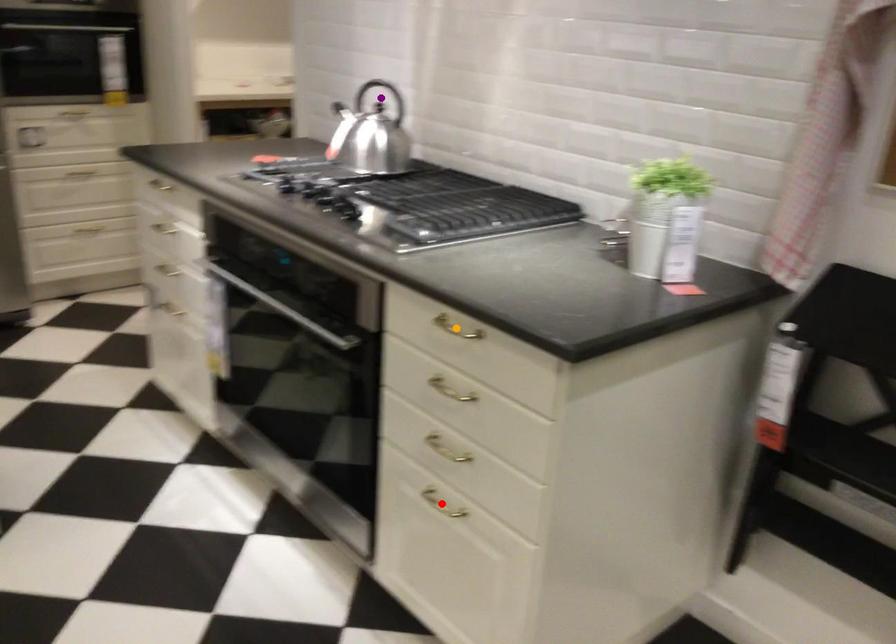
Order these from nearest to farthest:
A) purple point
B) orange point
C) red point

purple point, red point, orange point